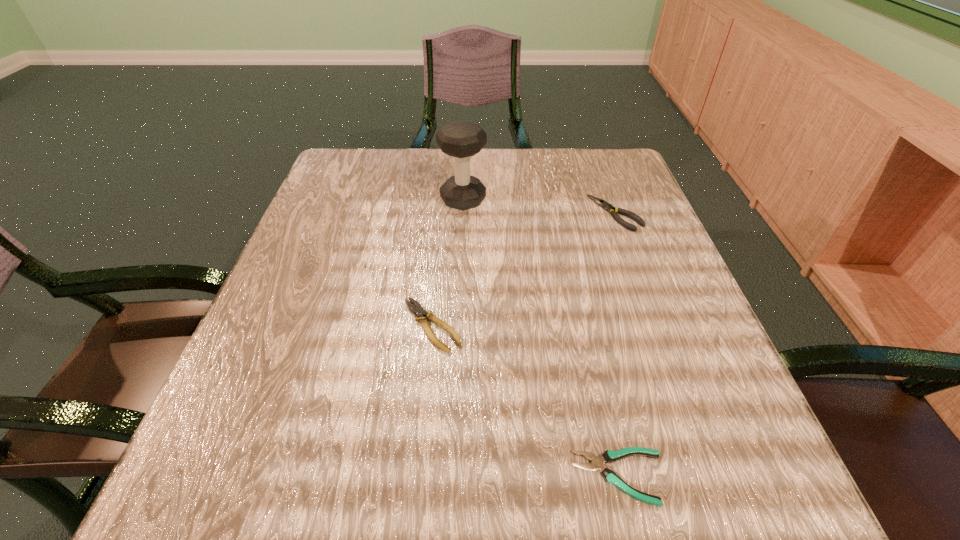
In order to click on vacant space located 0.230m on the back of the nearest object in this screenshot , I will do `click(584, 316)`.

Where is `dumbbell located in the far edge section of the desktop`? dumbbell located in the far edge section of the desktop is located at coordinates (461, 139).

Identify the location of pliers that is at the far edge. (605, 205).

Identify the location of object that is at the near edge. Image resolution: width=960 pixels, height=540 pixels. (597, 463).

Identify the location of object that is at the far right corner. (605, 205).

Identify the location of object that is at the near right corner. The height and width of the screenshot is (540, 960). (597, 463).

The image size is (960, 540). In order to click on vacant region at the far edge in this screenshot , I will do `click(436, 168)`.

In the image, there is a desktop. Identify the location of free space at the left edge. The width and height of the screenshot is (960, 540). (354, 303).

Where is `blank area at the right edge`? blank area at the right edge is located at coordinates (681, 356).

Find the location of a particular element. The height and width of the screenshot is (540, 960). vacant space at the far left corner of the desktop is located at coordinates (348, 184).